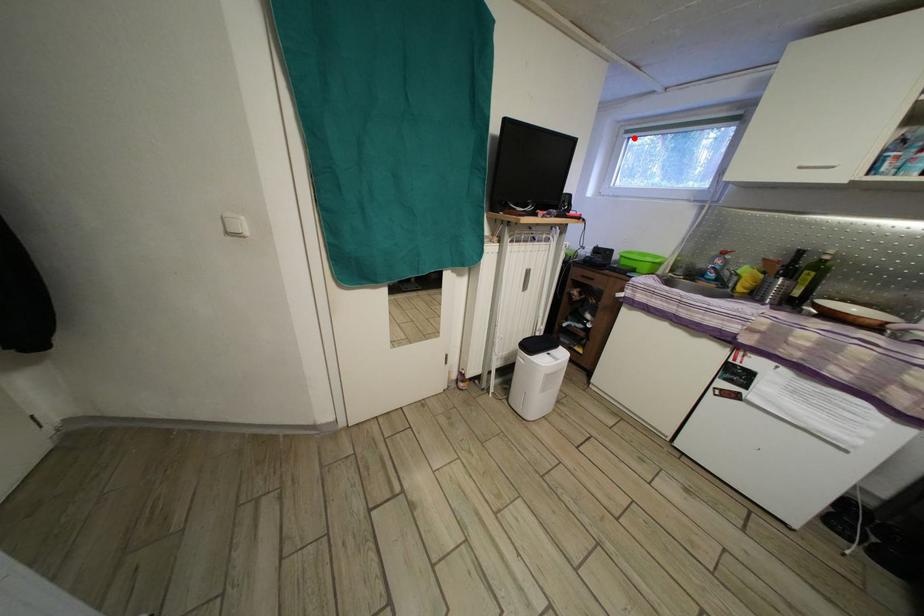
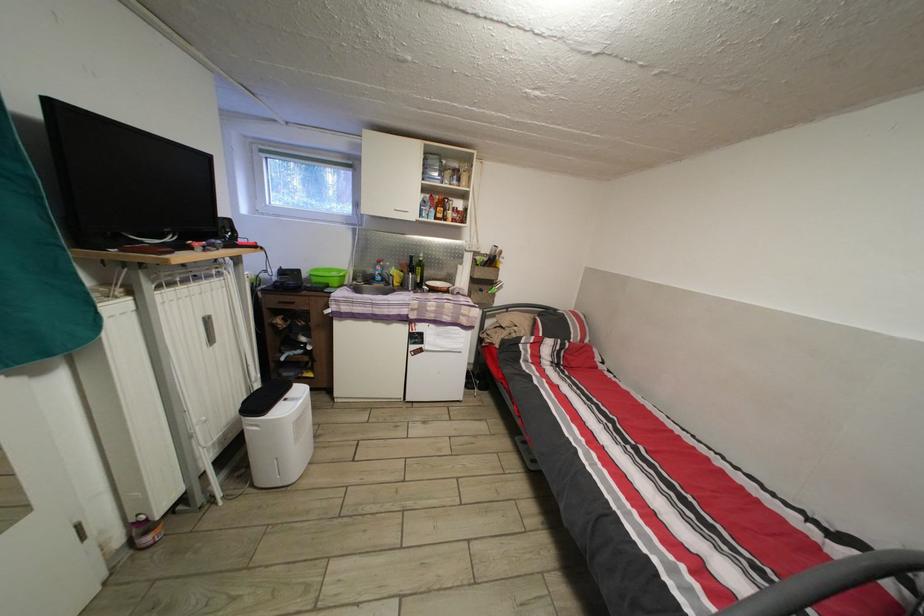
Find the pixel in the second image that matches the highlighted location in the first image.

(269, 156)